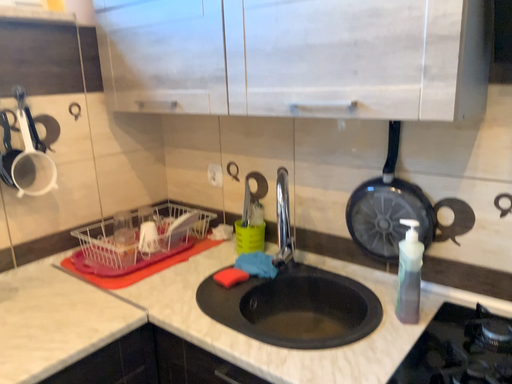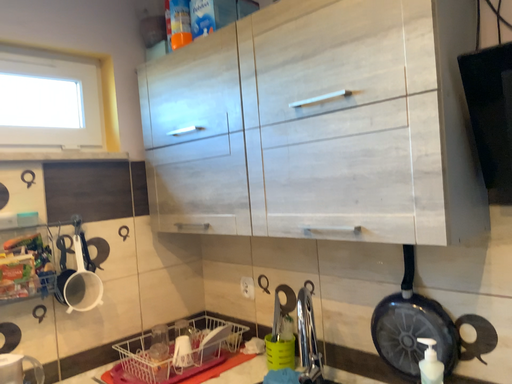
Question: Which way did the camera rotate in the video?

Choices:
 (A) rotated right
 (B) rotated left

Answer: (B)